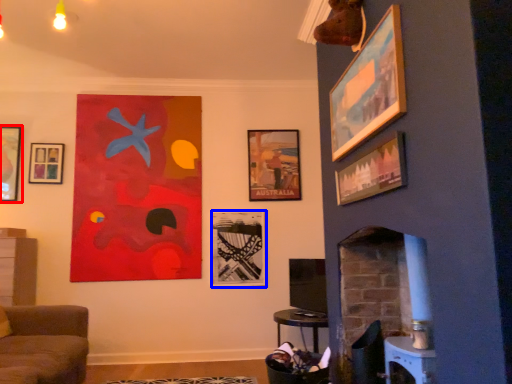
Question: Which point is further to the camera, picture frame (highlighted by a red box) or picture frame (highlighted by a blue box)?

Choices:
 (A) picture frame
 (B) picture frame

Answer: (B)